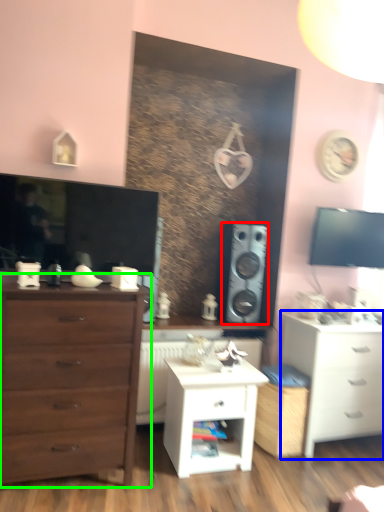
Question: Which object is the farthest from speaker (highlighted by a red box)? Choose among these: chest of drawers (highlighted by a blue box) or chest of drawers (highlighted by a green box).

Choices:
 (A) chest of drawers
 (B) chest of drawers

Answer: (B)